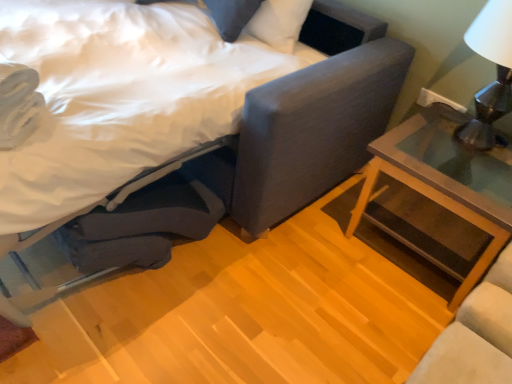
Question: Should I look upward or downward to see clear glass nightstand at right?

Choices:
 (A) up
 (B) down

Answer: (B)

Question: Is matte gray bed at center bigger than clear glass nightstand at right?

Choices:
 (A) no
 (B) yes

Answer: (B)

Question: Does matte gray bed at center appear on the left side of clear glass nightstand at right?

Choices:
 (A) no
 (B) yes

Answer: (B)

Question: Considering the relative sizes of matte gray bed at center and clear glass nightstand at right in the image provided, is matte gray bed at center smaller than clear glass nightstand at right?

Choices:
 (A) yes
 (B) no

Answer: (B)

Question: Is matte gray bed at center to the right of clear glass nightstand at right from the viewer's perspective?

Choices:
 (A) yes
 (B) no

Answer: (B)

Question: Can you confirm if matte gray bed at center is taller than clear glass nightstand at right?

Choices:
 (A) yes
 (B) no

Answer: (A)

Question: Can clear glass nightstand at right be found inside matte gray bed at center?

Choices:
 (A) yes
 (B) no

Answer: (B)

Question: Is clear glass nightstand at right placed right next to matte gray bed at center?

Choices:
 (A) yes
 (B) no

Answer: (B)

Question: Is clear glass nightstand at right behind matte gray bed at center?

Choices:
 (A) no
 (B) yes

Answer: (B)

Question: Is clear glass nightstand at right far from matte gray bed at center?

Choices:
 (A) no
 (B) yes

Answer: (A)

Question: Considering the relative sizes of clear glass nightstand at right and matte gray bed at center in the image provided, is clear glass nightstand at right taller than matte gray bed at center?

Choices:
 (A) yes
 (B) no

Answer: (B)

Question: Is clear glass nightstand at right positioned before matte gray bed at center?

Choices:
 (A) yes
 (B) no

Answer: (B)

Question: Considering the relative sizes of clear glass nightstand at right and matte gray bed at center in the image provided, is clear glass nightstand at right bigger than matte gray bed at center?

Choices:
 (A) yes
 (B) no

Answer: (B)

Question: From a real-world perspective, is matte gray bed at center positioned above or below clear glass nightstand at right?

Choices:
 (A) below
 (B) above

Answer: (B)